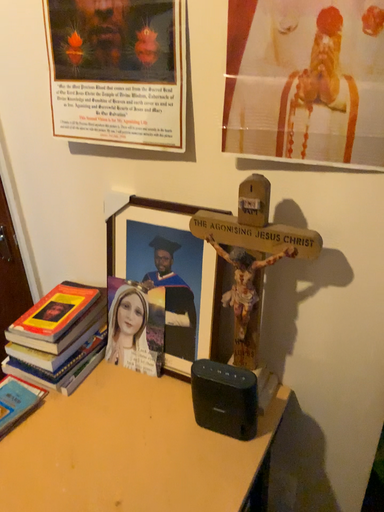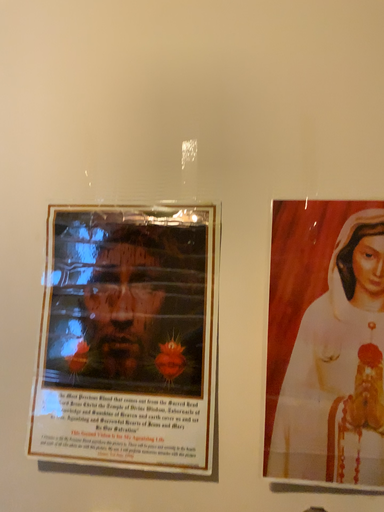
Question: How did the camera likely rotate when shooting the video?

Choices:
 (A) rotated right
 (B) rotated left

Answer: (A)